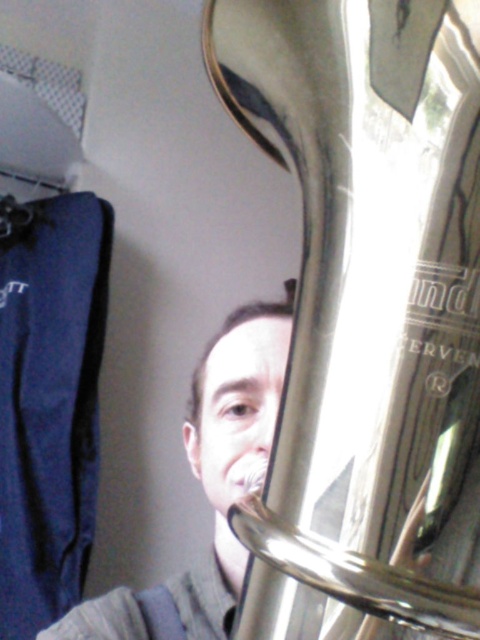
Question: Which of the following is the closest to the observer?

Choices:
 (A) polished silver trumpet at center
 (B) matte silver tuba at center

Answer: (A)

Question: Does polished silver trumpet at center come in front of matte silver tuba at center?

Choices:
 (A) no
 (B) yes

Answer: (B)

Question: Considering the relative positions of polished silver trumpet at center and matte silver tuba at center in the image provided, where is polished silver trumpet at center located with respect to matte silver tuba at center?

Choices:
 (A) above
 (B) below

Answer: (A)

Question: Is polished silver trumpet at center below matte silver tuba at center?

Choices:
 (A) no
 (B) yes

Answer: (A)

Question: Which point is closer to the camera?

Choices:
 (A) (323, 371)
 (B) (428, 483)

Answer: (B)